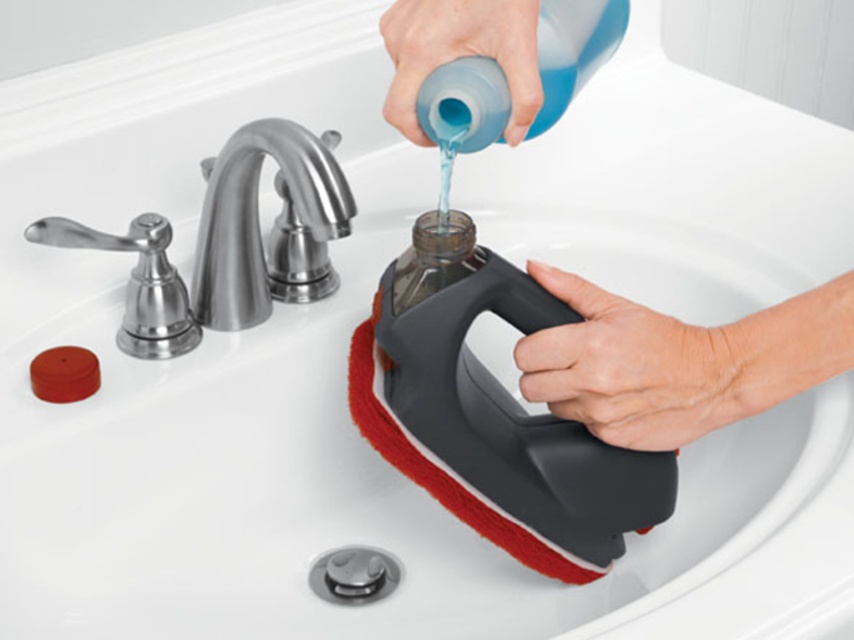
Question: Which point is closer to the camera taking this photo?

Choices:
 (A) (697, 355)
 (B) (75, 385)

Answer: (A)

Question: Which of these objects is positioned farthest from the brushed metal faucet at upper center?

Choices:
 (A) red matte soap at lower left
 (B) blue rubber glove at upper center

Answer: (B)

Question: In this image, where is blue rubber glove at upper center located relative to red matte soap at lower left?

Choices:
 (A) right
 (B) left

Answer: (A)

Question: Does gray rubber handle at lower right have a lesser width compared to blue rubber glove at upper center?

Choices:
 (A) yes
 (B) no

Answer: (B)

Question: Among these points, which one is farthest from the camera?

Choices:
 (A) (670, 376)
 (B) (224, 298)
 (C) (80, 394)
 (D) (408, 108)

Answer: (B)

Question: Where is brushed metal faucet at upper center located in relation to blue rubber glove at upper center in the image?

Choices:
 (A) below
 (B) above

Answer: (A)